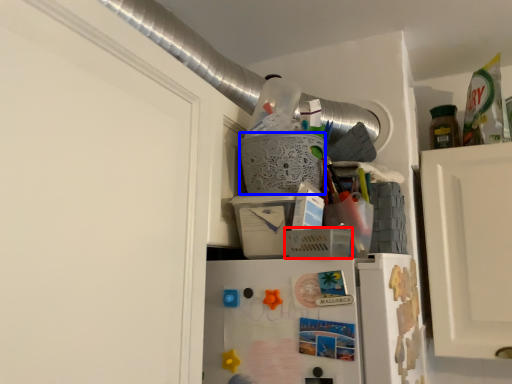
Question: Which object is closer to the camera taking this photo, basket (highlighted by a red box) or basket (highlighted by a blue box)?

Choices:
 (A) basket
 (B) basket

Answer: (A)